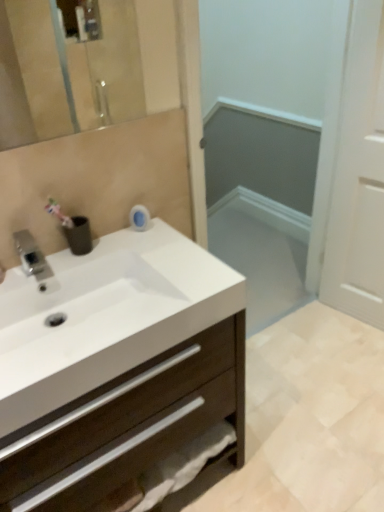
Question: Can you confirm if white matte door at right, which is the 2th screen door in left-to-right order, is positioned to the left of silver metallic faucet at upper left?

Choices:
 (A) no
 (B) yes

Answer: (A)

Question: Does white matte door at right, which is the 2th screen door in left-to-right order, have a greater height compared to silver metallic faucet at upper left?

Choices:
 (A) no
 (B) yes

Answer: (B)

Question: Can you confirm if white matte door at right, which is the 2th screen door in left-to-right order, is wider than silver metallic faucet at upper left?

Choices:
 (A) no
 (B) yes

Answer: (A)

Question: Does white matte door at right, the first screen door when ordered from right to left, lie behind silver metallic faucet at upper left?

Choices:
 (A) yes
 (B) no

Answer: (A)

Question: From a real-world perspective, is white matte door at right, the first screen door when ordered from right to left, positioned over silver metallic faucet at upper left based on gravity?

Choices:
 (A) yes
 (B) no

Answer: (B)

Question: Is silver metallic faucet at upper left spatially inside white glossy screen door at center, which appears as the 2th screen door when viewed from the right, or outside of it?

Choices:
 (A) outside
 (B) inside

Answer: (A)

Question: From a real-world perspective, is silver metallic faucet at upper left above or below white glossy screen door at center, which appears as the 2th screen door when viewed from the right?

Choices:
 (A) below
 (B) above

Answer: (B)

Question: Is silver metallic faucet at upper left in front of or behind white glossy screen door at center, the first screen door when ordered from left to right, in the image?

Choices:
 (A) behind
 (B) front

Answer: (B)

Question: From the image's perspective, is silver metallic faucet at upper left above or below white glossy screen door at center, the first screen door when ordered from left to right?

Choices:
 (A) below
 (B) above

Answer: (A)

Question: From a real-world perspective, is white matte cabinet at center above or below white glossy screen door at center, the first screen door when ordered from left to right?

Choices:
 (A) above
 (B) below

Answer: (B)

Question: Is white matte cabinet at center inside the boundaries of white glossy screen door at center, which appears as the 2th screen door when viewed from the right, or outside?

Choices:
 (A) inside
 (B) outside

Answer: (B)

Question: In terms of width, does white matte cabinet at center look wider or thinner when compared to white glossy screen door at center, which appears as the 2th screen door when viewed from the right?

Choices:
 (A) wide
 (B) thin

Answer: (A)

Question: Considering the positions of white matte cabinet at center and white glossy screen door at center, the first screen door when ordered from left to right, in the image, is white matte cabinet at center bigger or smaller than white glossy screen door at center, the first screen door when ordered from left to right,?

Choices:
 (A) big
 (B) small

Answer: (A)

Question: Considering the positions of white glossy screen door at center, the first screen door when ordered from left to right, and white matte door at right, the first screen door when ordered from right to left, in the image, is white glossy screen door at center, the first screen door when ordered from left to right, wider or thinner than white matte door at right, the first screen door when ordered from right to left,?

Choices:
 (A) thin
 (B) wide

Answer: (B)

Question: Choose the correct answer: Is white glossy screen door at center, the first screen door when ordered from left to right, inside white matte door at right, which is the 2th screen door in left-to-right order, or outside it?

Choices:
 (A) inside
 (B) outside

Answer: (B)